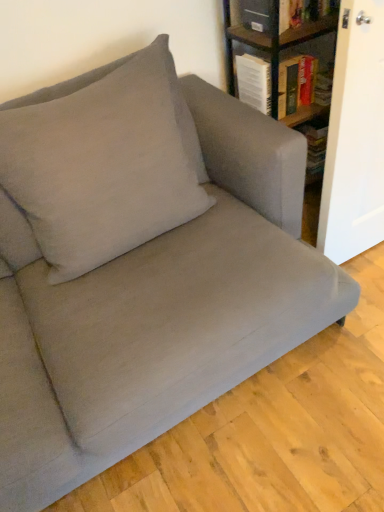
Where is `suede-like beige pillow at upper left`? The width and height of the screenshot is (384, 512). suede-like beige pillow at upper left is located at coordinates (101, 168).

Measure the distance between point (189, 218) and camera.

Point (189, 218) and camera are 4.54 feet apart.

The image size is (384, 512). What are the coordinates of `wooden bookshelf at upper right` in the screenshot? It's located at (290, 62).

Locate an element on the screen. The width and height of the screenshot is (384, 512). suede-like beige pillow at upper left is located at coordinates (101, 168).

Is point (273, 67) closer to camera compared to point (282, 68)?

Yes, it is.

Choose the correct answer: Is wooden bookshelf at upper right inside hardcover book at upper right or outside it?

The correct answer is: outside.

Which object is positioned more to the right, wooden bookshelf at upper right or hardcover book at upper right?

From the viewer's perspective, wooden bookshelf at upper right appears more on the right side.

Considering the sizes of objects suede-like beige pillow at upper left and wooden bookshelf at upper right in the image provided, who is wider, suede-like beige pillow at upper left or wooden bookshelf at upper right?

wooden bookshelf at upper right is wider.

Is there a large distance between suede-like beige pillow at upper left and wooden bookshelf at upper right?

That's not correct — suede-like beige pillow at upper left is a little close to wooden bookshelf at upper right.

From a real-world perspective, is suede-like beige pillow at upper left physically below wooden bookshelf at upper right?

Actually, suede-like beige pillow at upper left is physically above wooden bookshelf at upper right in the real world.

Is suede-like beige pillow at upper left situated inside wooden bookshelf at upper right or outside?

suede-like beige pillow at upper left is outside wooden bookshelf at upper right.

Is hardcover book at upper right thinner than suede-like beige pillow at upper left?

Correct, the width of hardcover book at upper right is less than that of suede-like beige pillow at upper left.

Can you tell me how much hardcover book at upper right and suede-like beige pillow at upper left differ in facing direction?

They differ by 1.04 degrees in their facing directions.

From a real-world perspective, between hardcover book at upper right and suede-like beige pillow at upper left, who is vertically lower?

From a 3D spatial view, hardcover book at upper right is below.

Is hardcover book at upper right bigger or smaller than suede-like beige pillow at upper left?

In the image, hardcover book at upper right appears to be smaller than suede-like beige pillow at upper left.

Would you say wooden bookshelf at upper right contains suede-like beige pillow at upper left?

Actually, suede-like beige pillow at upper left is outside wooden bookshelf at upper right.

Where is `shelf on the right of suede-like beige pillow at upper left`? This screenshot has height=512, width=384. shelf on the right of suede-like beige pillow at upper left is located at coordinates (290, 62).

Between wooden bookshelf at upper right and suede-like beige pillow at upper left, which one has less height?

wooden bookshelf at upper right is shorter.

From a real-world perspective, is wooden bookshelf at upper right positioned above or below suede-like beige pillow at upper left?

wooden bookshelf at upper right is situated lower than suede-like beige pillow at upper left in the real world.

Is hardcover book at upper right located outside wooden bookshelf at upper right?

That's incorrect, hardcover book at upper right is not completely outside wooden bookshelf at upper right.

Which of these two, hardcover book at upper right or wooden bookshelf at upper right, is wider?

With larger width is wooden bookshelf at upper right.

Locate an element on the screen. book below the wooden bookshelf at upper right (from the image's perspective) is located at coordinates pos(295,85).

I want to click on throw pillow to the left of hardcover book at upper right, so click(101, 168).

Which object is thinner, suede-like beige pillow at upper left or hardcover book at upper right?

With smaller width is hardcover book at upper right.

Does suede-like beige pillow at upper left have a lesser height compared to hardcover book at upper right?

No, suede-like beige pillow at upper left is not shorter than hardcover book at upper right.

From a real-world perspective, is suede-like beige pillow at upper left on hardcover book at upper right?

Yes.

Find the location of a particular element. This screenshot has height=512, width=384. shelf on the right of hardcover book at upper right is located at coordinates (290, 62).

Where is `throw pillow above the wooden bookshelf at upper right (from a real-world perspective)`? This screenshot has width=384, height=512. throw pillow above the wooden bookshelf at upper right (from a real-world perspective) is located at coordinates (101, 168).

Estimate the real-world distances between objects in this image. Which object is closer to wooden bookshelf at upper right, hardcover book at upper right or suede-like beige pillow at upper left?

Based on the image, hardcover book at upper right appears to be nearer to wooden bookshelf at upper right.

Estimate the real-world distances between objects in this image. Which object is further from hardcover book at upper right, wooden bookshelf at upper right or suede-like beige pillow at upper left?

suede-like beige pillow at upper left lies further to hardcover book at upper right than the other object.

Considering their positions, is suede-like beige pillow at upper left positioned further to hardcover book at upper right than wooden bookshelf at upper right?

Among the two, suede-like beige pillow at upper left is located further to hardcover book at upper right.

Estimate the real-world distances between objects in this image. Which object is further from suede-like beige pillow at upper left, wooden bookshelf at upper right or hardcover book at upper right?

wooden bookshelf at upper right lies further to suede-like beige pillow at upper left than the other object.

Estimate the real-world distances between objects in this image. Which object is closer to wooden bookshelf at upper right, suede-like beige pillow at upper left or hardcover book at upper right?

hardcover book at upper right is positioned closer to the anchor wooden bookshelf at upper right.

Looking at the image, which one is located further to suede-like beige pillow at upper left, hardcover book at upper right or wooden bookshelf at upper right?

Based on the image, wooden bookshelf at upper right appears to be further to suede-like beige pillow at upper left.

Find the location of a particular element. The width and height of the screenshot is (384, 512). book between suede-like beige pillow at upper left and wooden bookshelf at upper right is located at coordinates (295, 85).